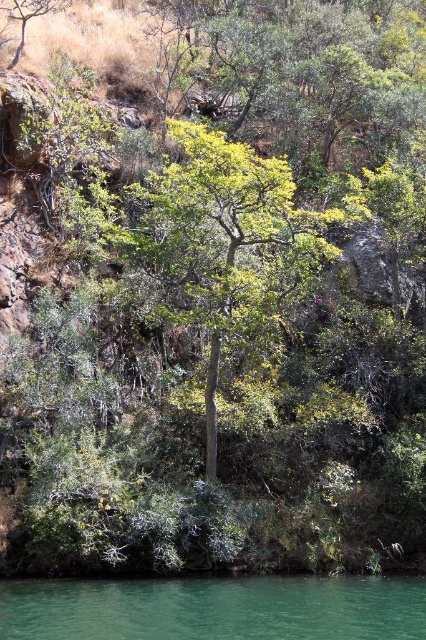
You are standing at the edge of the green translucent water at lower center and want to reach the green leafy tree at center. Which direction should you walk to get closer to the tree?

The green leafy tree at center is taller than the green translucent water at lower center. To reach the tree, you should walk towards the center of the image where the tree is located, moving away from the lower center area where the water is situated.

You are standing at the edge of the water in the scene. Which object is closer to you, the green leafy tree at center or the green translucent water at lower center?

The green leafy tree at center is closer to you because it is positioned further to the viewer than the green translucent water at lower center.

You are standing at the point marked by the coordinate point [224,241] in the image. What object are you directly facing?

You are directly facing the green leafy tree at center, as the point [224,241] represents its location.